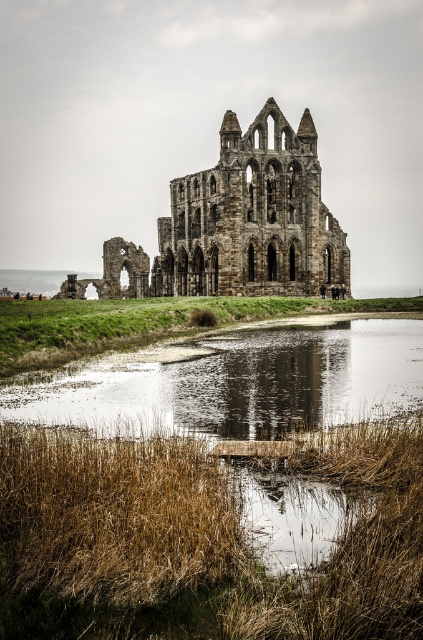
Between brown dry reed at lower left and stone gothic ruins at center, which one appears on the right side from the viewer's perspective?

stone gothic ruins at center

Is brown dry reed at lower left shorter than stone gothic ruins at center?

Correct, brown dry reed at lower left is not as tall as stone gothic ruins at center.

You are a GUI agent. You are given a task and a screenshot of the screen. Output one action in this format:
    pyautogui.click(x=<x>, y=<y>)
    Task: Click on the brown dry reed at lower left
    
    Given the screenshot: What is the action you would take?
    pyautogui.click(x=114, y=516)